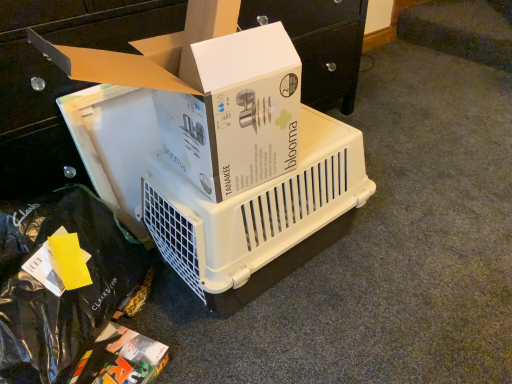
The height and width of the screenshot is (384, 512). What are the coordinates of `white plastic crate at center, acting as the 2th box starting from the bottom` in the screenshot? It's located at (209, 94).

This screenshot has width=512, height=384. I want to click on multicolored cardboard box at lower left, the third box positioned from the top, so click(x=121, y=359).

Describe the element at coordinates (60, 283) in the screenshot. I see `black plastic bag at lower left` at that location.

At what (x,y) coordinates should I click in order to perform the action: click on white plastic crate at center, the 2th box in the top-to-bottom sequence. Please return your answer as a coordinate pair (x, y). Looking at the image, I should click on (209, 94).

Is white plastic pet carrier at center facing away from black plastic bag at lower left?

white plastic pet carrier at center is not turned away from black plastic bag at lower left.

Is white plastic pet carrier at center at the left side of black plastic bag at lower left?

No, white plastic pet carrier at center is not to the left of black plastic bag at lower left.

From the image's perspective, which is below, multicolored cardboard box at lower left, the third box positioned from the top, or white cardboard box at upper center, positioned as the third box in bottom-to-top order?

multicolored cardboard box at lower left, the third box positioned from the top, appears lower in the image.

Between multicolored cardboard box at lower left, placed as the first box when sorted from bottom to top, and white cardboard box at upper center, positioned as the third box in bottom-to-top order, which one has larger size?

Bigger between the two is white cardboard box at upper center, positioned as the third box in bottom-to-top order.

Considering the relative sizes of multicolored cardboard box at lower left, placed as the first box when sorted from bottom to top, and white cardboard box at upper center, the 1th box positioned from the top, in the image provided, is multicolored cardboard box at lower left, placed as the first box when sorted from bottom to top, wider than white cardboard box at upper center, the 1th box positioned from the top,?

Incorrect, the width of multicolored cardboard box at lower left, placed as the first box when sorted from bottom to top, does not surpass that of white cardboard box at upper center, the 1th box positioned from the top.

From a real-world perspective, does multicolored cardboard box at lower left, the third box positioned from the top, stand above white plastic crate at center, acting as the 2th box starting from the bottom?

No, from a real-world perspective, multicolored cardboard box at lower left, the third box positioned from the top, is not over white plastic crate at center, acting as the 2th box starting from the bottom

What's the angular difference between multicolored cardboard box at lower left, placed as the first box when sorted from bottom to top, and white plastic crate at center, the 2th box in the top-to-bottom sequence,'s facing directions?

multicolored cardboard box at lower left, placed as the first box when sorted from bottom to top, and white plastic crate at center, the 2th box in the top-to-bottom sequence, are facing 25.7 degrees away from each other.

Does multicolored cardboard box at lower left, placed as the first box when sorted from bottom to top, have a lesser height compared to white plastic crate at center, acting as the 2th box starting from the bottom?

Correct, multicolored cardboard box at lower left, placed as the first box when sorted from bottom to top, is not as tall as white plastic crate at center, acting as the 2th box starting from the bottom.

Is multicolored cardboard box at lower left, placed as the first box when sorted from bottom to top, looking in the opposite direction of white plastic pet carrier at center?

No.

Which point is more forward, (x=90, y=354) or (x=311, y=155)?

Positioned in front is point (x=90, y=354).

Which is more to the right, multicolored cardboard box at lower left, the third box positioned from the top, or white plastic pet carrier at center?

white plastic pet carrier at center.

Is multicolored cardboard box at lower left, the third box positioned from the top, taller than white plastic pet carrier at center?

Incorrect, the height of multicolored cardboard box at lower left, the third box positioned from the top, is not larger of that of white plastic pet carrier at center.

Which object is positioned more to the right, white plastic crate at center, acting as the 2th box starting from the bottom, or black plastic bag at lower left?

white plastic crate at center, acting as the 2th box starting from the bottom.

Is point (284, 91) in front of point (29, 243)?

Yes, point (284, 91) is closer to viewer.

In terms of size, does white plastic crate at center, acting as the 2th box starting from the bottom, appear bigger or smaller than black plastic bag at lower left?

white plastic crate at center, acting as the 2th box starting from the bottom, is smaller than black plastic bag at lower left.

Is white cardboard box at upper center, positioned as the third box in bottom-to-top order, in front of multicolored cardboard box at lower left, placed as the first box when sorted from bottom to top?

Yes, white cardboard box at upper center, positioned as the third box in bottom-to-top order, is closer to the camera.

From a real-world perspective, is white cardboard box at upper center, positioned as the third box in bottom-to-top order, physically below multicolored cardboard box at lower left, placed as the first box when sorted from bottom to top?

No, from a real-world perspective, white cardboard box at upper center, positioned as the third box in bottom-to-top order, is not under multicolored cardboard box at lower left, placed as the first box when sorted from bottom to top.

Between white cardboard box at upper center, the 1th box positioned from the top, and multicolored cardboard box at lower left, placed as the first box when sorted from bottom to top, which one has larger width?

white cardboard box at upper center, the 1th box positioned from the top, is wider.

How many degrees apart are the facing directions of black plastic bag at lower left and white cardboard box at upper center, the 1th box positioned from the top?

The angular difference between black plastic bag at lower left and white cardboard box at upper center, the 1th box positioned from the top, is 65.7 degrees.

Considering the points (62, 212) and (194, 155), which point is in front, point (62, 212) or point (194, 155)?

Positioned in front is point (194, 155).

From a real-world perspective, is black plastic bag at lower left positioned above or below white cardboard box at upper center, the 1th box positioned from the top?

In terms of real-world spatial position, black plastic bag at lower left is below white cardboard box at upper center, the 1th box positioned from the top.

Is black plastic bag at lower left at the right side of white cardboard box at upper center, positioned as the third box in bottom-to-top order?

No, black plastic bag at lower left is not to the right of white cardboard box at upper center, positioned as the third box in bottom-to-top order.

Image resolution: width=512 pixels, height=384 pixels. What are the coordinates of `garbage below the white plastic pet carrier at center (from the image's perspective)` in the screenshot? It's located at (60, 283).

Which box is the 2nd one when counting from the left side of the white cardboard box at upper center, the 1th box positioned from the top? Please provide its 2D coordinates.

[(121, 359)]

From the image, which object appears to be nearer to white plastic pet carrier at center, white cardboard box at upper center, the 1th box positioned from the top, or black plastic bag at lower left?

The object closer to white plastic pet carrier at center is white cardboard box at upper center, the 1th box positioned from the top.

Based on their spatial positions, is black plastic bag at lower left or white plastic pet carrier at center further from white plastic crate at center, the 2th box in the top-to-bottom sequence?

The object further to white plastic crate at center, the 2th box in the top-to-bottom sequence, is black plastic bag at lower left.

Looking at the image, which one is located further to white cardboard box at upper center, the 1th box positioned from the top, black plastic bag at lower left or white plastic crate at center, the 2th box in the top-to-bottom sequence?

black plastic bag at lower left is further to white cardboard box at upper center, the 1th box positioned from the top.

Looking at the image, which one is located closer to multicolored cardboard box at lower left, the third box positioned from the top, white cardboard box at upper center, the 1th box positioned from the top, or white plastic pet carrier at center?

The object closer to multicolored cardboard box at lower left, the third box positioned from the top, is white plastic pet carrier at center.

Which object lies nearer to the anchor point white cardboard box at upper center, the 1th box positioned from the top, white plastic crate at center, acting as the 2th box starting from the bottom, or black plastic bag at lower left?

Among the two, white plastic crate at center, acting as the 2th box starting from the bottom, is located nearer to white cardboard box at upper center, the 1th box positioned from the top.

Based on their spatial positions, is white plastic crate at center, acting as the 2th box starting from the bottom, or white cardboard box at upper center, the 1th box positioned from the top, further from multicolored cardboard box at lower left, the third box positioned from the top?

white plastic crate at center, acting as the 2th box starting from the bottom.

Consider the image. Estimate the real-world distances between objects in this image. Which object is further from white cardboard box at upper center, the 1th box positioned from the top, white plastic pet carrier at center or multicolored cardboard box at lower left, placed as the first box when sorted from bottom to top?

multicolored cardboard box at lower left, placed as the first box when sorted from bottom to top, lies further to white cardboard box at upper center, the 1th box positioned from the top, than the other object.

Which object lies further to the anchor point white plastic pet carrier at center, black plastic bag at lower left or white plastic crate at center, acting as the 2th box starting from the bottom?

black plastic bag at lower left is positioned further to the anchor white plastic pet carrier at center.

You are a GUI agent. You are given a task and a screenshot of the screen. Output one action in this format:
    pyautogui.click(x=<x>, y=<y>)
    Task: Click on the garbage between white plastic crate at center, acting as the 2th box starting from the bottom, and multicolored cardboard box at lower left, placed as the first box when sorted from bottom to top, vertically
    This screenshot has height=384, width=512.
    Given the screenshot: What is the action you would take?
    pyautogui.click(x=60, y=283)

Where is `garbage between white cardboard box at upper center, the 1th box positioned from the top, and multicolored cardboard box at lower left, the third box positioned from the top, vertically`? Image resolution: width=512 pixels, height=384 pixels. garbage between white cardboard box at upper center, the 1th box positioned from the top, and multicolored cardboard box at lower left, the third box positioned from the top, vertically is located at coordinates (60, 283).

The width and height of the screenshot is (512, 384). What are the coordinates of `appliance between white plastic crate at center, acting as the 2th box starting from the bottom, and multicolored cardboard box at lower left, the third box positioned from the top, from top to bottom` in the screenshot? It's located at (258, 217).

You are a GUI agent. You are given a task and a screenshot of the screen. Output one action in this format:
    pyautogui.click(x=<x>, y=<y>)
    Task: Click on the box between white cardboard box at upper center, positioned as the third box in bottom-to-top order, and black plastic bag at lower left vertically
    The height and width of the screenshot is (384, 512).
    Given the screenshot: What is the action you would take?
    click(209, 94)